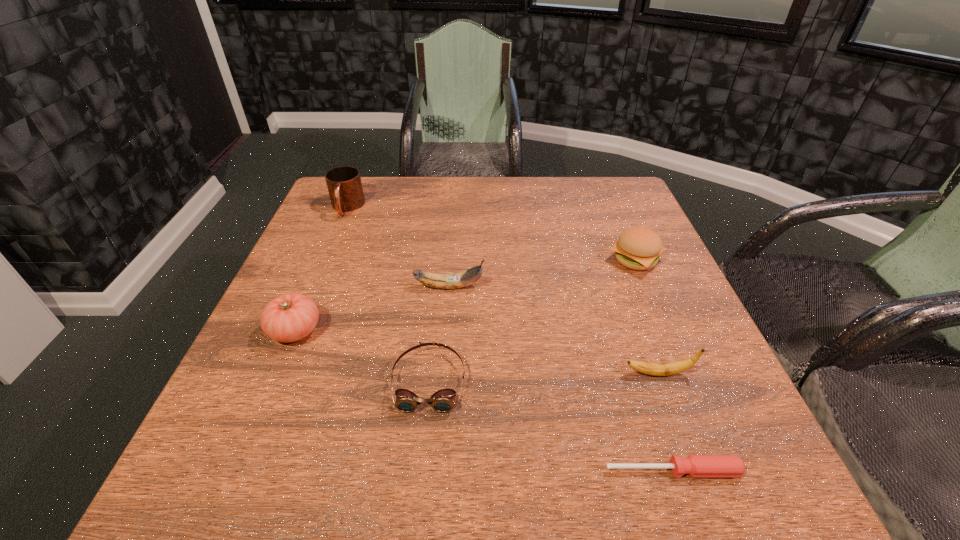
Where is `vacant space that satisfies the following two spatial constraints: 1. on the side of the hamburger with the handle; 2. on the right side of the farthest object`? This screenshot has height=540, width=960. vacant space that satisfies the following two spatial constraints: 1. on the side of the hamburger with the handle; 2. on the right side of the farthest object is located at coordinates (324, 260).

Locate an element on the screen. The image size is (960, 540). free space that satisfies the following two spatial constraints: 1. through the lenses of the goggles; 2. on the left side of the screwdriver is located at coordinates [x=420, y=470].